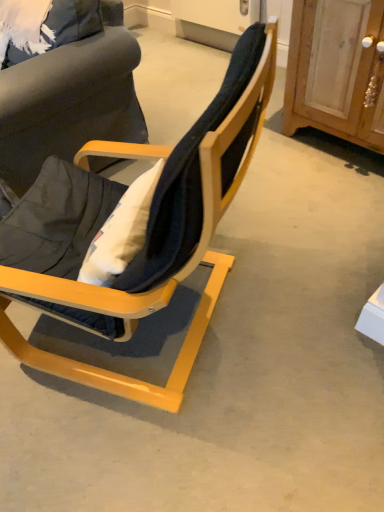
The height and width of the screenshot is (512, 384). Find the location of `free space in front of wooden rocking chair at center`. free space in front of wooden rocking chair at center is located at coordinates (155, 449).